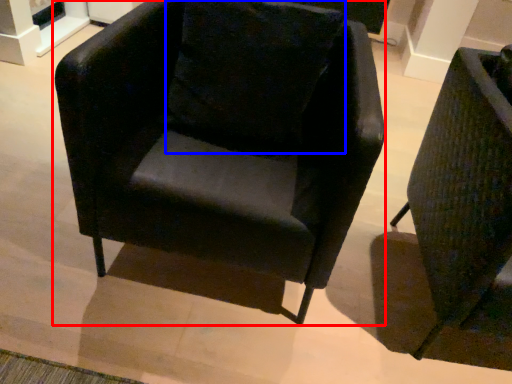
Question: Which object is closer to the camera taking this photo, chair (highlighted by a red box) or pillow (highlighted by a blue box)?

Choices:
 (A) chair
 (B) pillow

Answer: (A)